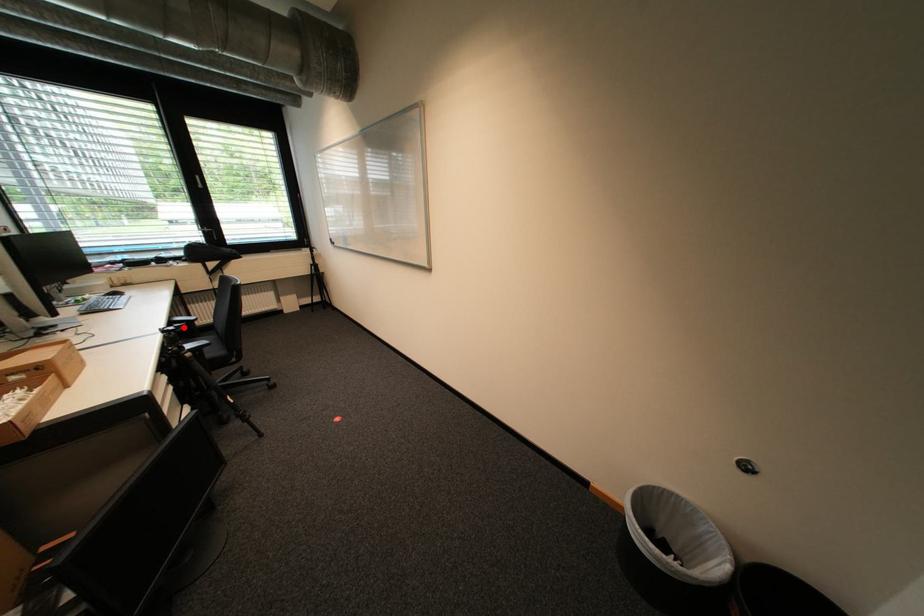
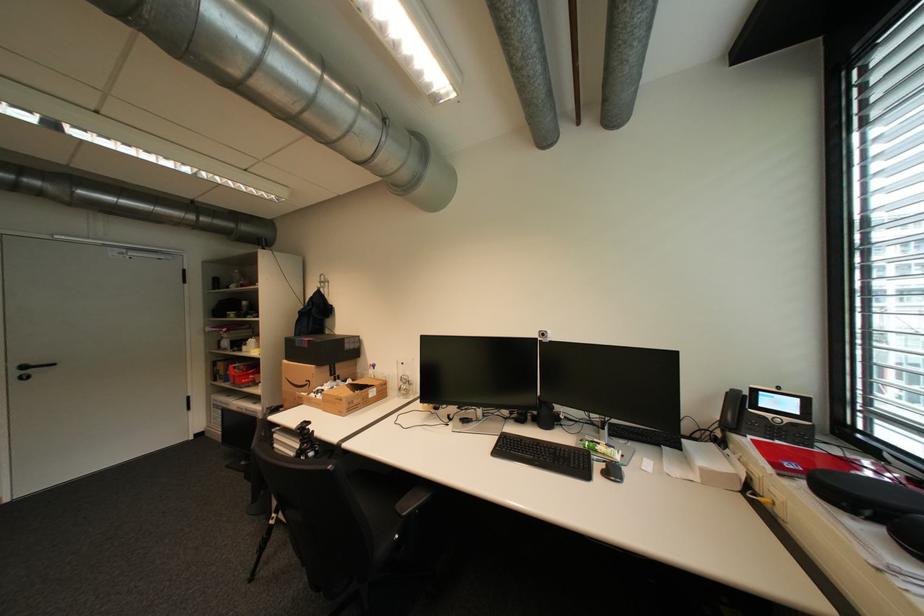
Question: I am providing you with two images of the same scene from different viewpoints. A red point is marked on the first image. Can you still see the location of the red point in image 2?

Choices:
 (A) Yes
 (B) No

Answer: (B)